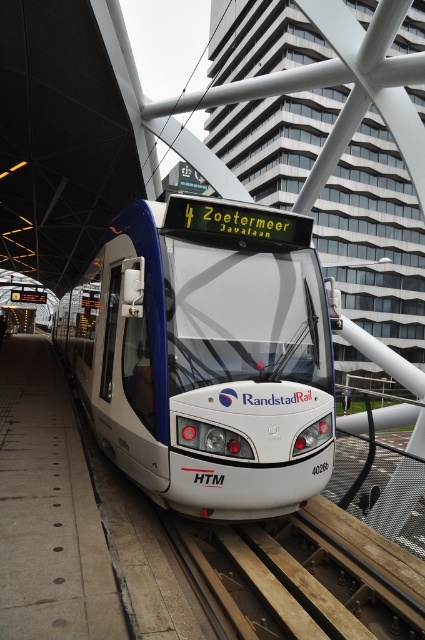
Consider the image. You are a toy train enthusiast who wants to place the white glossy train at center onto the brown wooden train track at lower center. Based on the scene description, can you determine if the train will fit onto the track?

The white glossy train at center is 4.28 feet away from the brown wooden train track at lower center. Since the distance between them is greater than zero, the train can be moved to the track, but the question of fit depends on compatibility between the train and track specifications not provided here.

Consider the image. You are a passenger waiting at the station. You see the white glossy train at center and the brown wooden train track at lower center. Which object is taller?

The white glossy train at center is taller than the brown wooden train track at lower center.